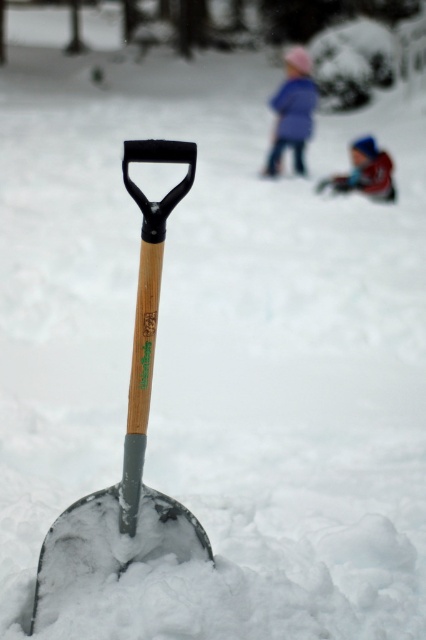
You are a photographer trying to capture the blue woolen sweater at upper center in your shot. Based on the scene description, where should you position your camera to ensure the sweater is centered in the frame?

The blue woolen sweater at upper center is located at point (293, 112). To center it in the frame, position your camera so that the crosshairs align with those coordinates.

You are standing in a snowy landscape and see the metallic silver shovel at center and the blue knit hat at upper center. Which object is positioned lower in the image?

The metallic silver shovel at center is positioned below the blue knit hat at upper center, so the shovel is lower in the image.

You are trying to reach the blue woolen sweater at upper center to retrieve it. Is the metallic silver shovel at center blocking your path?

The metallic silver shovel at center is in front of the blue woolen sweater at upper center, so it is blocking your path.